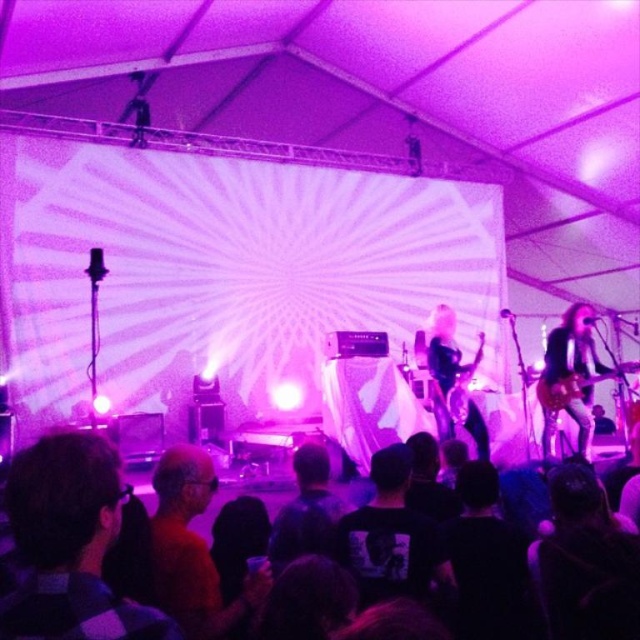
Question: Does shiny black guitar at right come behind shiny black guitar at center?

Choices:
 (A) no
 (B) yes

Answer: (A)

Question: Which point is farther from the camera taking this photo?

Choices:
 (A) (176, 625)
 (B) (573, 372)
 (C) (88, 449)
 (D) (481, 340)

Answer: (D)

Question: Which point is farther to the camera?

Choices:
 (A) (10, 477)
 (B) (385, 588)
 (C) (620, 371)
 (D) (449, 397)

Answer: (D)

Question: Can you confirm if plaid shirt at lower left is thinner than shiny black guitar at right?

Choices:
 (A) no
 (B) yes

Answer: (B)

Question: Which point is closer to the camera?

Choices:
 (A) dark blue shirt at center
 (B) black t-shirt at center
 (C) shiny black guitar at right
 (D) black fabric crowd at lower center

Answer: (D)

Question: Does black t-shirt at center appear under shiny black guitar at right?

Choices:
 (A) yes
 (B) no

Answer: (A)